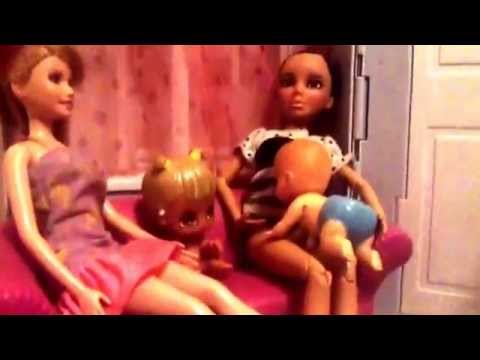
The image size is (480, 360). Find the location of `silver door frame`. silver door frame is located at coordinates (395, 109).